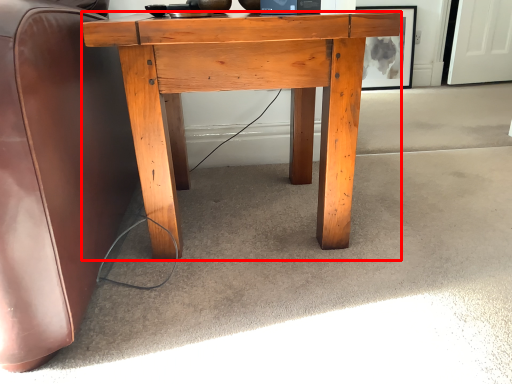
Question: From the image's perspective, considering the relative positions of desk (annotated by the red box) and picture frame in the image provided, where is desk (annotated by the red box) located with respect to the staircase?

Choices:
 (A) above
 (B) below

Answer: (B)